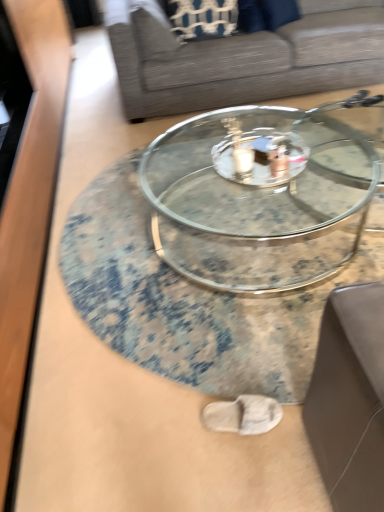
Question: Is gray fabric couch at center in front of or behind transparent glass coffee table at center, the first coffee table viewed from the front, in the image?

Choices:
 (A) front
 (B) behind

Answer: (B)

Question: Based on their sizes in the image, would you say gray fabric couch at center is bigger or smaller than transparent glass coffee table at center, the first coffee table viewed from the front?

Choices:
 (A) big
 (B) small

Answer: (A)

Question: Estimate the real-world distances between objects in this image. Which object is closer to the clear glass coffee table at center, the 1th coffee table when ordered from back to front?

Choices:
 (A) transparent glass coffee table at center, the first coffee table viewed from the front
 (B) gray fabric couch at center

Answer: (A)

Question: Estimate the real-world distances between objects in this image. Which object is closer to the transparent glass coffee table at center, the first coffee table viewed from the front?

Choices:
 (A) gray fabric couch at center
 (B) clear glass coffee table at center, the 2th coffee table from the front

Answer: (B)